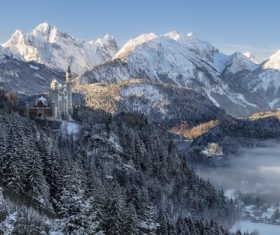
Locate an element on the screen. The image size is (280, 235). shade is located at coordinates (224, 88).